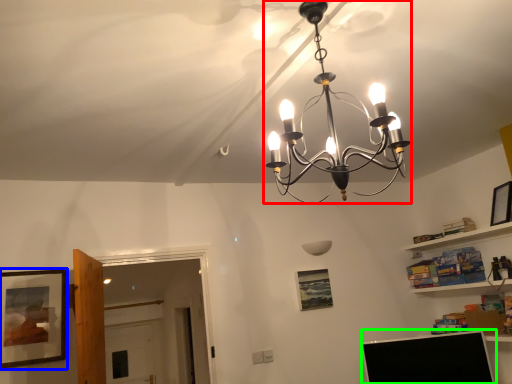
Question: Which is nearer to the lamp (highlighted by a red box)? picture frame (highlighted by a blue box) or computer monitor (highlighted by a green box).

Choices:
 (A) picture frame
 (B) computer monitor

Answer: (A)